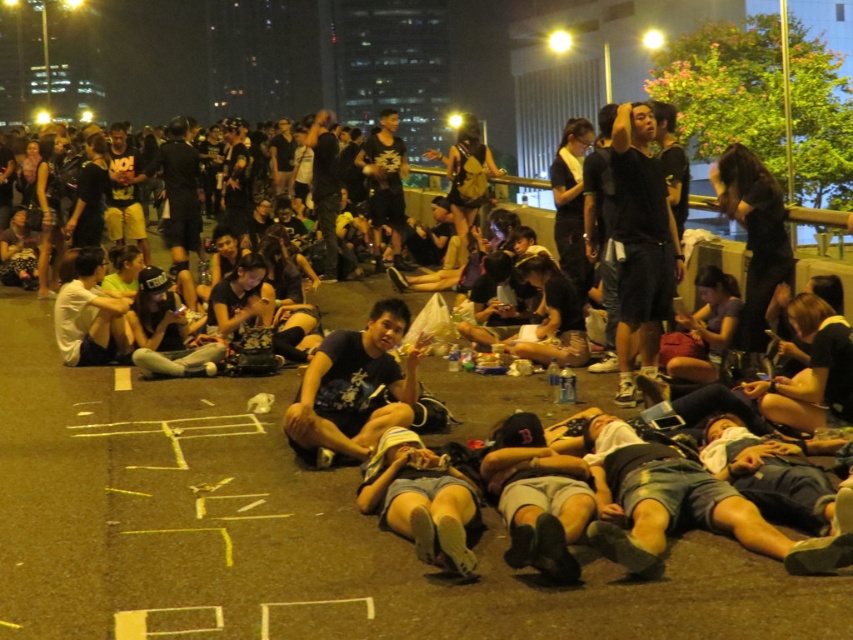
Question: Is dark blue t-shirt at center smaller than gray fabric shorts at lower center?

Choices:
 (A) no
 (B) yes

Answer: (A)

Question: Does dark asphalt pavement at center have a larger size compared to dark gray fabric cap at center?

Choices:
 (A) no
 (B) yes

Answer: (A)

Question: Can you confirm if dark gray fabric cap at center is positioned above gray fabric shorts at lower center?

Choices:
 (A) yes
 (B) no

Answer: (A)

Question: Which is farther from the dark gray fabric cap at center?

Choices:
 (A) dark blue t-shirt at center
 (B) black matte shorts at center
 (C) gray fabric shorts at lower center

Answer: (B)

Question: Which of the following is the farthest from the observer?

Choices:
 (A) white matte shirt at center
 (B) black matte shorts at center
 (C) gray fabric shorts at lower center
 (D) dark asphalt pavement at center

Answer: (A)

Question: Considering the real-world distances, which object is farthest from the dark blue t-shirt at center?

Choices:
 (A) dark gray fabric cap at center
 (B) gray fabric shorts at lower center
 (C) black matte shorts at center
 (D) dark asphalt pavement at center

Answer: (C)